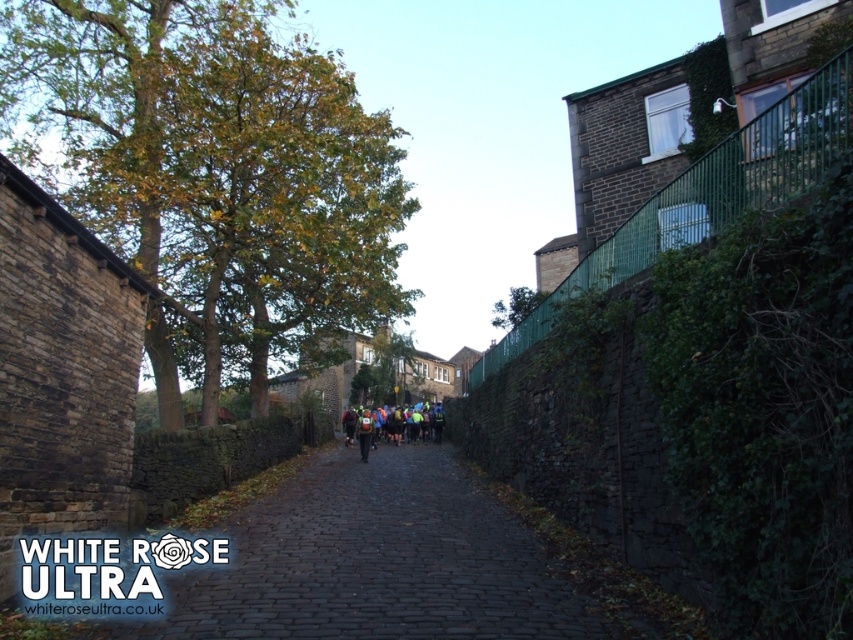
Between point (387, 596) and point (386, 416), which one is positioned in front?

Point (387, 596) is more forward.

Describe the element at coordinates (386, 561) in the screenshot. I see `dark cobblestone path at center` at that location.

Find the location of a particular element. Image resolution: width=853 pixels, height=640 pixels. dark cobblestone path at center is located at coordinates (386, 561).